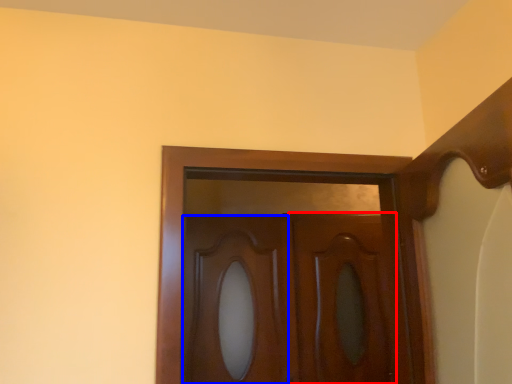
Question: Which point is further to the camera, screen door (highlighted by a red box) or cabinetry (highlighted by a blue box)?

Choices:
 (A) screen door
 (B) cabinetry

Answer: (A)